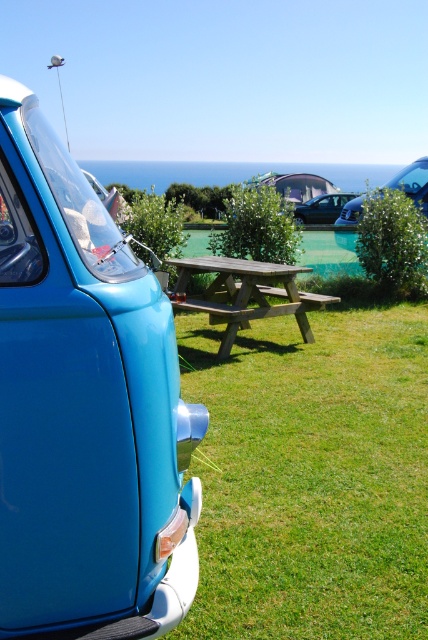
Question: Which is nearer to the wooden picnic table at center?

Choices:
 (A) satin black car at center
 (B) matte blue minivan at left

Answer: (B)

Question: Does matte blue minivan at left appear under satin black car at center?

Choices:
 (A) yes
 (B) no

Answer: (A)

Question: Does metallic blue car at center come behind satin black car at center?

Choices:
 (A) yes
 (B) no

Answer: (B)

Question: Is matte blue minivan at left wider than metallic blue car at center?

Choices:
 (A) yes
 (B) no

Answer: (A)

Question: Which of the following is the farthest from the observer?

Choices:
 (A) (424, 179)
 (B) (308, 205)
 (C) (193, 484)
 (D) (219, 288)

Answer: (B)

Question: Which point is closer to the camera taking this photo?

Choices:
 (A) (237, 323)
 (B) (356, 200)
 (C) (318, 205)

Answer: (A)